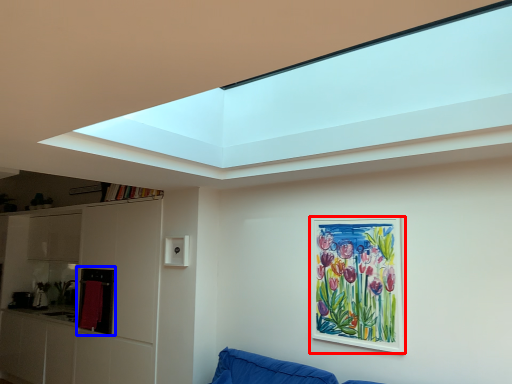
Question: Which object is closer to the camera taking this photo, picture frame (highlighted by a red box) or cabinet (highlighted by a blue box)?

Choices:
 (A) picture frame
 (B) cabinet

Answer: (A)